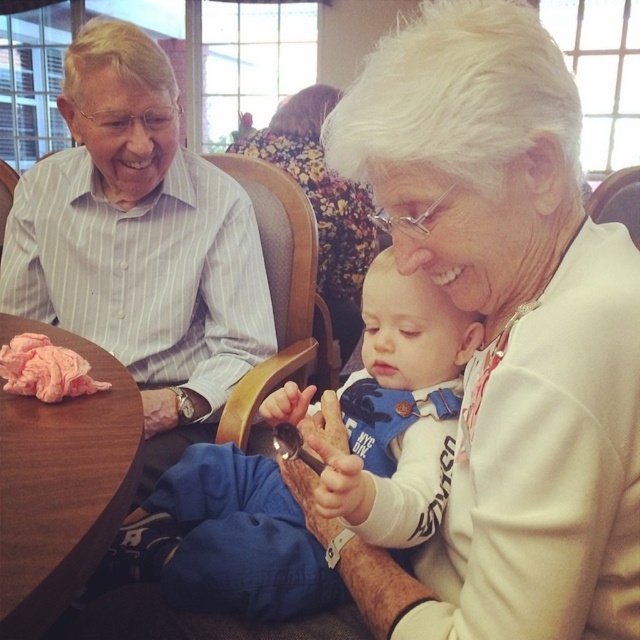
You are a photographer trying to capture a closeup of the white soft baby at center while also including the white striped shirt at upper left in the frame. Can you position yourself in a way that both objects are visible without moving any furniture?

The white striped shirt at upper left is positioned on the left side of white soft baby at center, so yes, you can position yourself to the right of the white soft baby at center to include both in the frame.

You are a photographer positioned at the center of the scene. You want to take a photo of the white striped shirt at upper left and ensure it is centered in your viewfinder. Which direction should you move your camera to align the shirt with the center of the frame?

The white striped shirt at upper left is located at point [140,243], so you should move your camera to the right and slightly downward to center it.

You are a photographer trying to capture a candid shot of the scene. You notice the white striped shirt at upper left and the pink fabric at table left. Which object should you focus on first if you want to capture the one that is taller?

The white striped shirt at upper left is taller than the pink fabric at table left, so you should focus on the white striped shirt at upper left first.